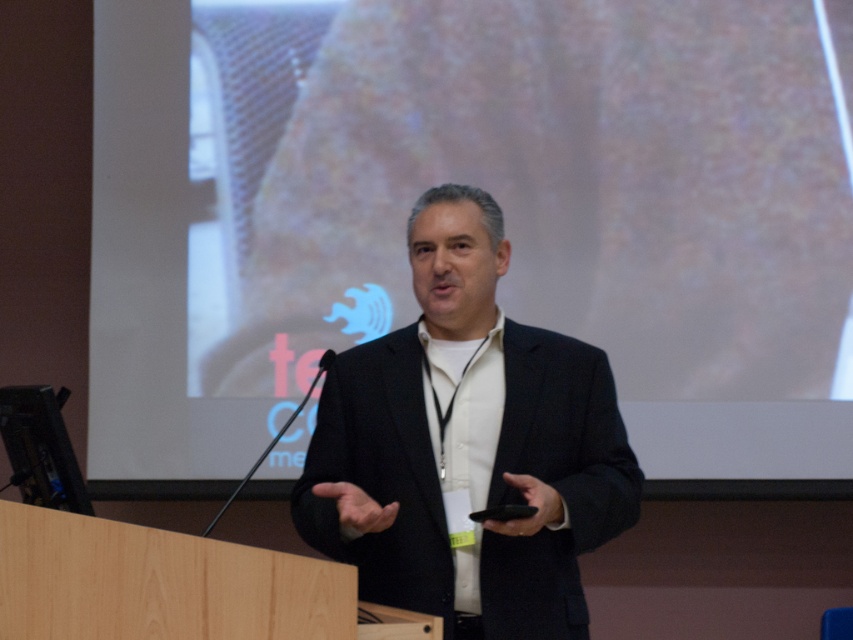
Question: Can you confirm if white matte projection screen at upper center is wider than black matte suit at center?

Choices:
 (A) no
 (B) yes

Answer: (B)

Question: Is white matte projection screen at upper center below black matte suit at center?

Choices:
 (A) yes
 (B) no

Answer: (B)

Question: Which point is farther to the camera?

Choices:
 (A) (619, 109)
 (B) (451, 296)

Answer: (A)

Question: Among these objects, which one is nearest to the camera?

Choices:
 (A) white matte projection screen at upper center
 (B) black matte suit at center

Answer: (B)

Question: Is white matte projection screen at upper center thinner than black matte suit at center?

Choices:
 (A) yes
 (B) no

Answer: (B)